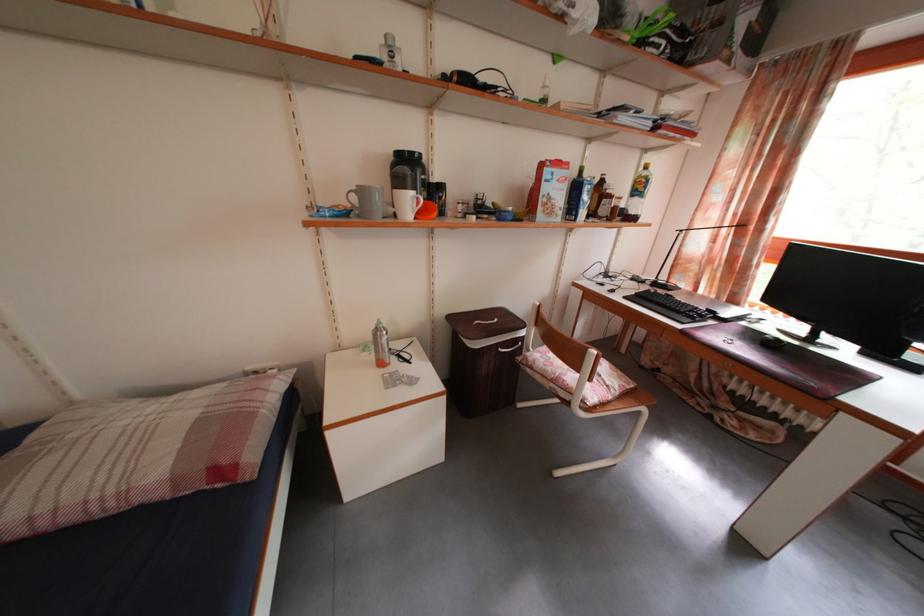
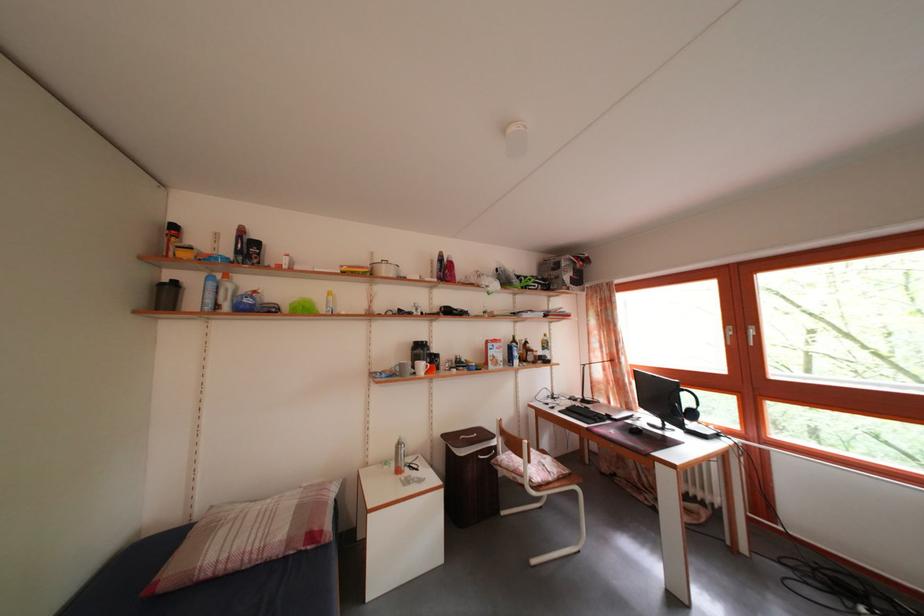
Question: The images are taken continuously from a first-person perspective. In which direction is your viewpoint rotating?

Choices:
 (A) Left
 (B) Right
 (C) Up
 (D) Down

Answer: (C)